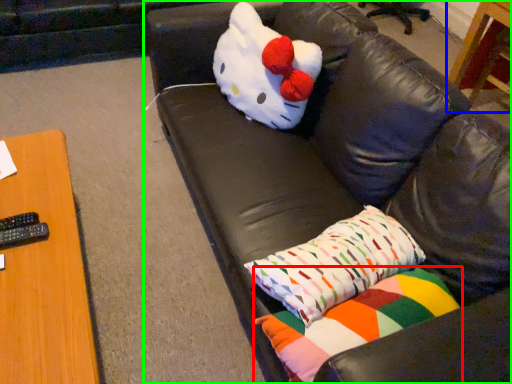
Question: Which object is the closest to the pillow (highlighted by a red box)? Choose among these: table (highlighted by a blue box) or studio couch (highlighted by a green box).

Choices:
 (A) table
 (B) studio couch

Answer: (B)